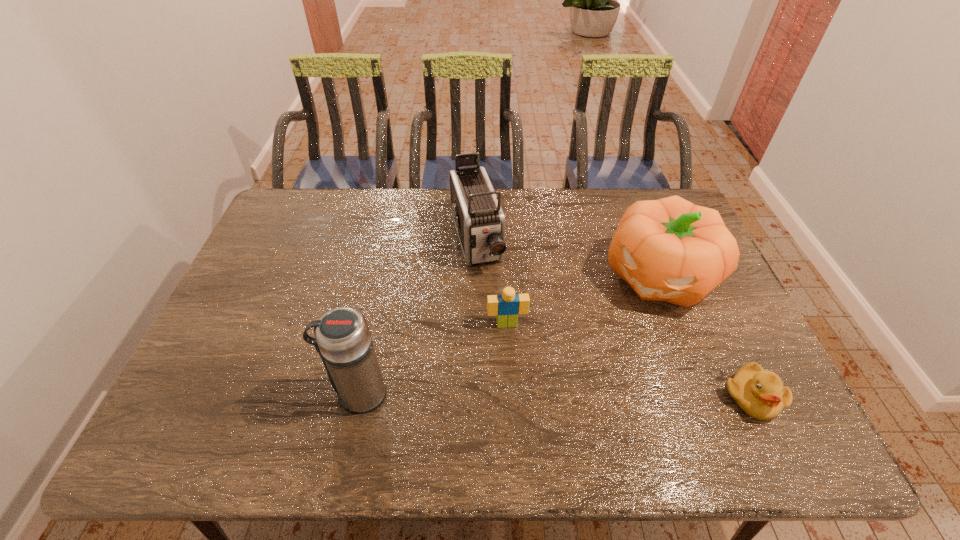
You are a GUI agent. You are given a task and a screenshot of the screen. Output one action in this format:
    pyautogui.click(x=<x>, y=<y>)
    Task: Click on the duckling that is positioned at the right edge
    Image resolution: width=960 pixels, height=540 pixels.
    Given the screenshot: What is the action you would take?
    pyautogui.click(x=760, y=394)

Image resolution: width=960 pixels, height=540 pixels. What are the coordinates of `pumpkin at the right edge` in the screenshot? It's located at (671, 250).

You are a GUI agent. You are given a task and a screenshot of the screen. Output one action in this format:
    pyautogui.click(x=<x>, y=<y>)
    Task: Click on the object that is at the near right corner
    
    Given the screenshot: What is the action you would take?
    pyautogui.click(x=760, y=394)

Where is `free space at the far edge of the desktop`? free space at the far edge of the desktop is located at coordinates (499, 190).

Locate an element on the screen. This screenshot has width=960, height=540. free space at the near edge is located at coordinates (578, 403).

This screenshot has height=540, width=960. I want to click on free space at the left edge of the desktop, so click(237, 286).

This screenshot has height=540, width=960. What are the coordinates of `vacant space at the far left corner of the desktop` in the screenshot? It's located at (304, 195).

Where is `free space between the duckling and the leftmost object`? The height and width of the screenshot is (540, 960). free space between the duckling and the leftmost object is located at coordinates (555, 395).

The image size is (960, 540). What are the coordinates of `vacant area that lies between the second shortest object and the pumpkin` in the screenshot? It's located at (582, 300).

Image resolution: width=960 pixels, height=540 pixels. Find the location of `empty space between the duckling and the Lego`. empty space between the duckling and the Lego is located at coordinates (629, 361).